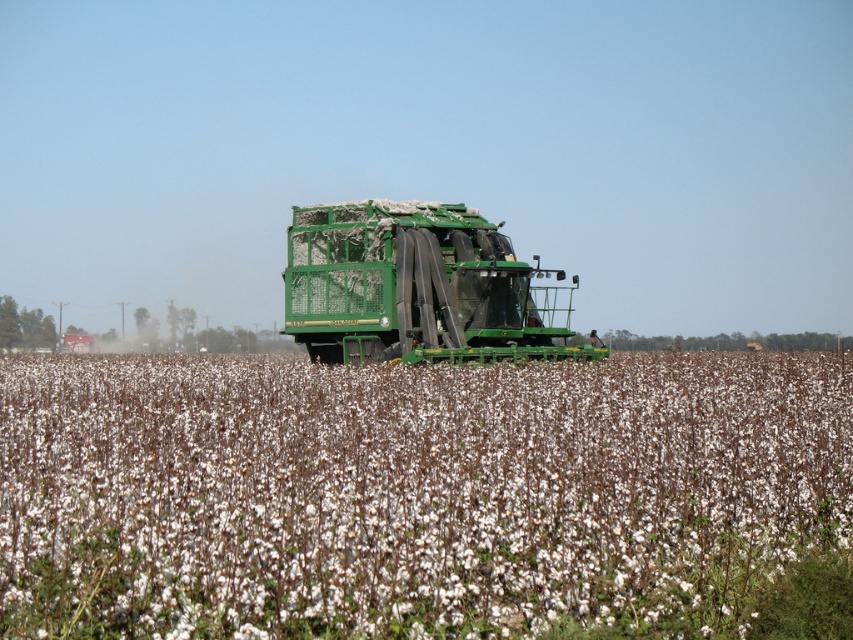
Question: Is white fluffy cotton at center bigger than green matte trailer truck at center?

Choices:
 (A) yes
 (B) no

Answer: (A)

Question: Is white fluffy cotton at center to the right of green matte trailer truck at center from the viewer's perspective?

Choices:
 (A) yes
 (B) no

Answer: (A)

Question: Which point appears closest to the camera in this image?

Choices:
 (A) (364, 268)
 (B) (376, 556)

Answer: (B)

Question: Among these objects, which one is farthest from the camera?

Choices:
 (A) white fluffy cotton at center
 (B) green matte trailer truck at center

Answer: (B)

Question: Is white fluffy cotton at center thinner than green matte trailer truck at center?

Choices:
 (A) yes
 (B) no

Answer: (B)